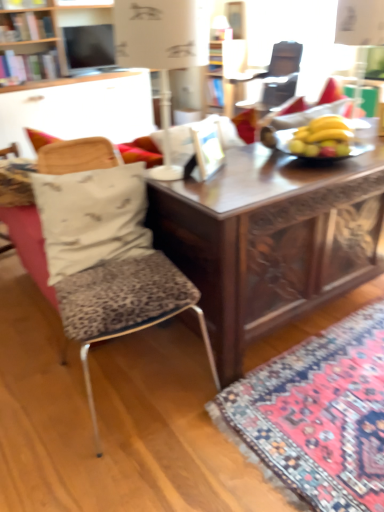
You are a GUI agent. You are given a task and a screenshot of the screen. Output one action in this format:
    pyautogui.click(x=<x>, y=<y>)
    Task: Click on the free space in front of wooden picture frame at center
    The image size is (384, 512).
    Given the screenshot: What is the action you would take?
    pyautogui.click(x=220, y=181)